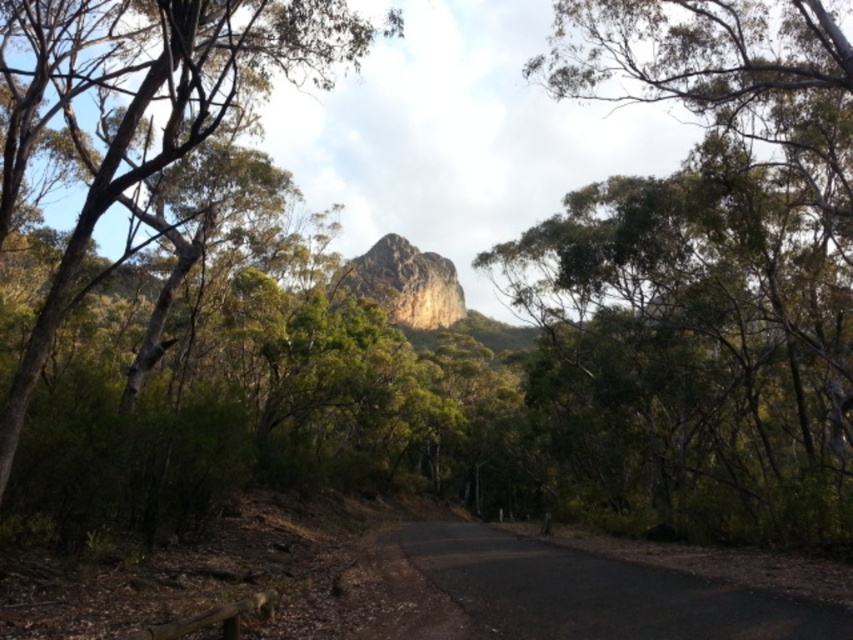
You are standing at point [149,109] in the image. Based on the scene description, what object is located at your current position?

The green leafy tree at upper left is located at point [149,109].

You are a hiker planning to take a photo of the black asphalt road at center. You want to ensure the green leafy tree at upper left doesn not block the view. Based on the scene description, will the tree be wider than the road?

The green leafy tree at upper left is wider than the black asphalt road at center, so it may block the view of the road if positioned in front or overlapping.